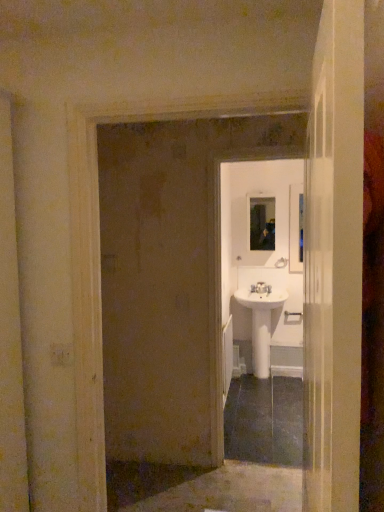
Question: Considering the relative positions of white glossy door at center and silver metallic door handle at center in the image provided, is white glossy door at center to the left or to the right of silver metallic door handle at center?

Choices:
 (A) right
 (B) left

Answer: (B)

Question: Is white glossy door at center taller or shorter than silver metallic door handle at center?

Choices:
 (A) short
 (B) tall

Answer: (B)

Question: Which is farther from the silver metallic door handle at center?

Choices:
 (A) white glossy sink at center
 (B) white plastic light switch at lower left
 (C) white ceramic sink at center
 (D) metallic reflective mirror at center
 (E) white glossy door at center

Answer: (E)

Question: Estimate the real-world distances between objects in this image. Which object is closer to the metallic reflective mirror at center?

Choices:
 (A) white ceramic sink at center
 (B) white plastic light switch at lower left
 (C) white glossy sink at center
 (D) white glossy door at center
 (E) silver metallic door handle at center

Answer: (C)